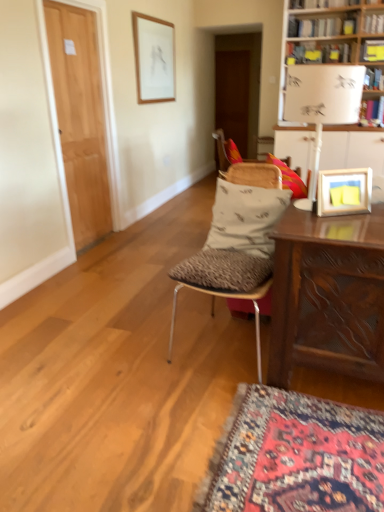
Find the location of a particular element. The height and width of the screenshot is (512, 384). vacant area that is in front of light brown wood door at left, the second door positioned from the top is located at coordinates (97, 258).